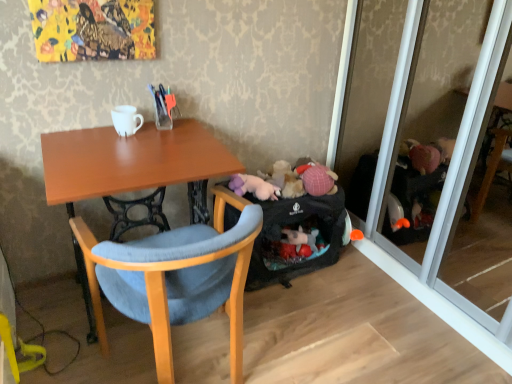
Identify the location of free location above wooden table at center (from a real-world perspective). This screenshot has height=384, width=512. tap(131, 152).